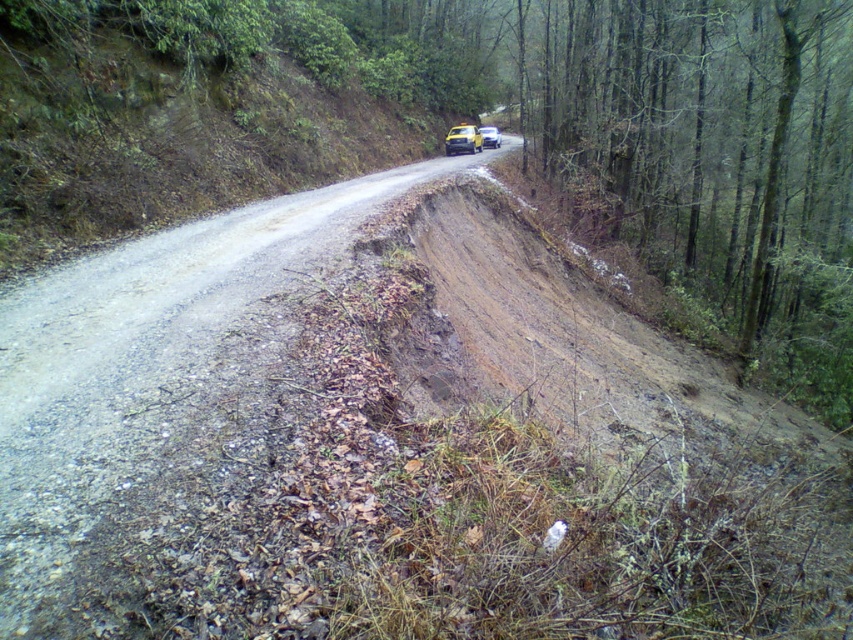
The width and height of the screenshot is (853, 640). Describe the element at coordinates (462, 140) in the screenshot. I see `yellow matte jeep at center` at that location.

Which is above, yellow matte jeep at center or yellow matte car at center?

yellow matte car at center is higher up.

Is point (471, 136) farther from viewer compared to point (486, 136)?

No.

Locate an element on the screen. yellow matte jeep at center is located at coordinates (462, 140).

Is dirt road at center below yellow matte jeep at center?

Correct, dirt road at center is located below yellow matte jeep at center.

The image size is (853, 640). I want to click on dirt road at center, so click(149, 362).

Is point (54, 435) closer to viewer compared to point (466, 148)?

Yes, it is.

Find the location of `dirt road at center`. dirt road at center is located at coordinates (149, 362).

Does brown/dry leaves at right appear under yellow matte jeep at center?

Incorrect, brown/dry leaves at right is not positioned below yellow matte jeep at center.

Is brown/dry leaves at right to the left of yellow matte jeep at center from the viewer's perspective?

In fact, brown/dry leaves at right is to the right of yellow matte jeep at center.

Is point (770, 45) closer to camera compared to point (467, 144)?

That is True.

Where is `brown/dry leaves at right`? The image size is (853, 640). brown/dry leaves at right is located at coordinates (704, 138).